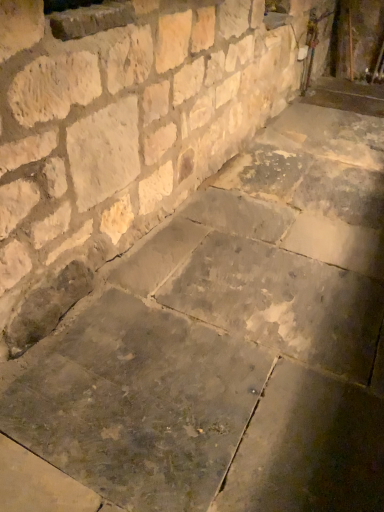
Identify the location of smooth stone hole at upper left. The width and height of the screenshot is (384, 512). (88, 17).

This screenshot has height=512, width=384. Describe the element at coordinates (88, 17) in the screenshot. I see `smooth stone hole at upper left` at that location.

Find the location of `smooth stone hole at upper left`. smooth stone hole at upper left is located at coordinates (88, 17).